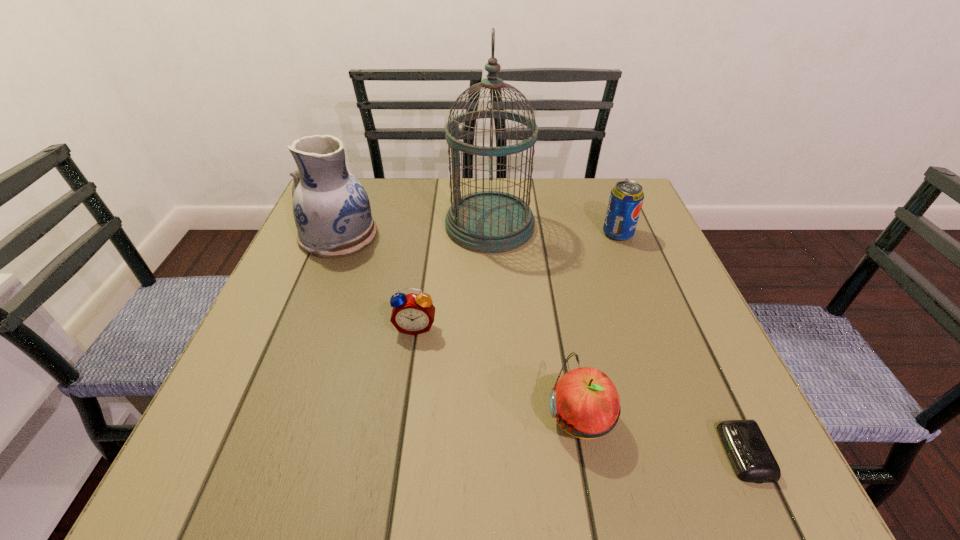
Locate an element on the screen. This screenshot has height=540, width=960. pottery that is at the far edge is located at coordinates (331, 209).

Locate an element on the screen. soda situated at the far edge is located at coordinates coord(626,198).

Image resolution: width=960 pixels, height=540 pixels. What are the coordinates of `apple positioned at the near edge` in the screenshot? It's located at (586, 403).

The height and width of the screenshot is (540, 960). I want to click on alarm clock at the near edge, so click(x=747, y=449).

Image resolution: width=960 pixels, height=540 pixels. What are the coordinates of `object located in the left edge section of the desktop` in the screenshot? It's located at (331, 209).

The height and width of the screenshot is (540, 960). Identify the location of soda that is at the right edge. (626, 198).

Identify the location of alarm clock that is at the right edge. The image size is (960, 540). pyautogui.click(x=747, y=449).

This screenshot has width=960, height=540. In order to click on object located in the far left corner section of the desktop in this screenshot , I will do `click(331, 209)`.

Where is `object present at the far right corner`? The width and height of the screenshot is (960, 540). object present at the far right corner is located at coordinates (626, 198).

Identify the location of object that is at the near right corner. (747, 449).